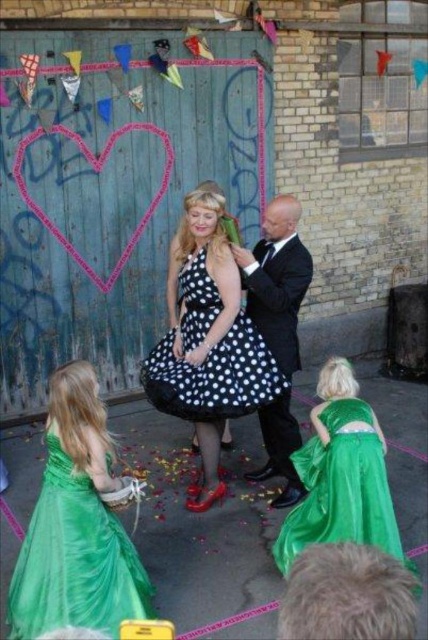
You are standing at the wooden gate and want to place a decoration at point (228, 406) and another decoration at point (284, 312). Which decoration will be closer to the gate?

The decoration placed at point (228, 406) will be closer to the gate because it is in front of point (284, 312).

You are a photographer at the event and need to position your camera to capture both the green satin dress at lower left and the shiny black suit at center. Which object takes up more space in the frame?

The shiny black suit at center occupies more space in the frame than the green satin dress at lower left.